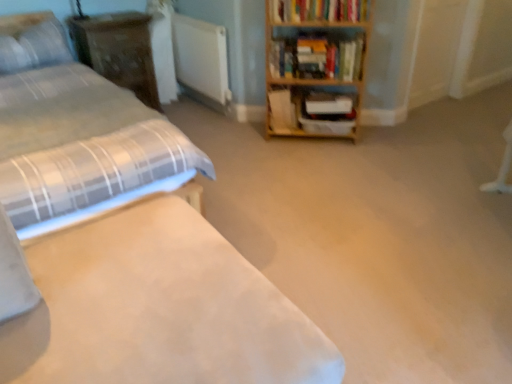
Find the location of a particular element. vacant space to the left of wooden bookcase at upper right is located at coordinates (245, 145).